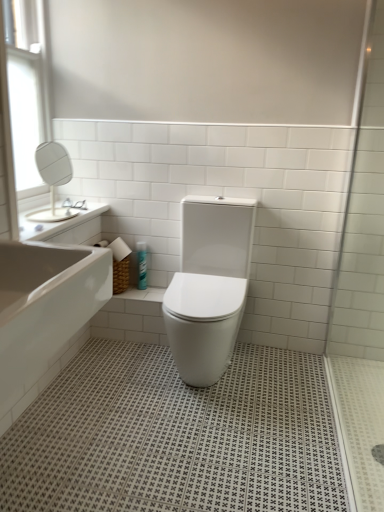
The width and height of the screenshot is (384, 512). I want to click on transparent glass shower door at right, so click(x=363, y=220).

What is the approximate height of white glossy toilet at center?

83.12 centimeters.

The width and height of the screenshot is (384, 512). Describe the element at coordinates (43, 313) in the screenshot. I see `white glossy bathtub at lower left` at that location.

Where is `white glass window at upper left`? white glass window at upper left is located at coordinates (26, 86).

Identify the location of white glossy sink at upper left. Image resolution: width=384 pixels, height=512 pixels. (60, 205).

From a real-world perspective, is woven brown basket at lower left physically located above or below blue glossy spray can at center?

In terms of real-world spatial position, woven brown basket at lower left is above blue glossy spray can at center.

I want to click on toiletry that appears below the woven brown basket at lower left (from the image's perspective), so click(x=142, y=265).

Is point (120, 240) farther from viewer compared to point (138, 268)?

That is True.

In the scene shown: Who is smaller, woven brown basket at lower left or blue glossy spray can at center?

blue glossy spray can at center.

Considering the points (59, 225) and (32, 364), which point is in front, point (59, 225) or point (32, 364)?

The point (32, 364) is closer to the camera.

Which object is further away from the camera, white glossy sink at upper left or white glossy bathtub at lower left?

white glossy sink at upper left is more distant.

From the image's perspective, is white glossy sink at upper left located above or below white glossy bathtub at lower left?

white glossy sink at upper left is above white glossy bathtub at lower left.

Considering the relative positions of white glossy bathtub at lower left and white glossy sink at upper left in the image provided, is white glossy bathtub at lower left to the right of white glossy sink at upper left from the viewer's perspective?

Yes, white glossy bathtub at lower left is to the right of white glossy sink at upper left.

Which is nearer, (56, 269) or (100, 226)?

The point (56, 269) is closer to the camera.

Is white glossy bathtub at lower left positioned far away from white glossy sink at upper left?

white glossy bathtub at lower left is actually quite close to white glossy sink at upper left.

Is white glossy bathtub at lower left wider or thinner than white glossy sink at upper left?

In the image, white glossy bathtub at lower left appears to be wider than white glossy sink at upper left.

Does point (9, 345) come in front of point (13, 5)?

Yes, point (9, 345) is in front of point (13, 5).

From the image's perspective, is white glossy bathtub at lower left located beneath white glass window at upper left?

Yes.

How different are the orientations of white glossy bathtub at lower left and white glass window at upper left in degrees?

The facing directions of white glossy bathtub at lower left and white glass window at upper left are 1.12 degrees apart.

Are white glossy bathtub at lower left and white glass window at upper left making contact?

They are not placed beside each other.

Considering the relative sizes of blue glossy spray can at center and white glossy bathtub at lower left in the image provided, is blue glossy spray can at center wider than white glossy bathtub at lower left?

In fact, blue glossy spray can at center might be narrower than white glossy bathtub at lower left.

Is blue glossy spray can at center oriented away from white glossy bathtub at lower left?

No, white glossy bathtub at lower left is not at the back of blue glossy spray can at center.

There is a blue glossy spray can at center. Identify the location of bath above it (from a real-world perspective). (43, 313).

What's the angular difference between blue glossy spray can at center and white glossy bathtub at lower left's facing directions?

The angular difference between blue glossy spray can at center and white glossy bathtub at lower left is 87.7 degrees.

Considering the positions of point (355, 272) and point (188, 369), is point (355, 272) closer or farther from the camera than point (188, 369)?

Point (355, 272).

Are transparent glass shower door at right and white glossy toilet at center making contact?

No.

Is transparent glass shower door at right facing away from white glossy toilet at center?

No.

From the image's perspective, does transparent glass shower door at right appear higher than white glossy toilet at center?

Yes, from the image's perspective, transparent glass shower door at right is above white glossy toilet at center.

Considering the relative positions of woven brown basket at lower left and transparent glass shower door at right in the image provided, is woven brown basket at lower left to the left or to the right of transparent glass shower door at right?

woven brown basket at lower left is positioned on transparent glass shower door at right's left side.

Does woven brown basket at lower left lie behind transparent glass shower door at right?

Answer: Yes, it is behind transparent glass shower door at right.

Is transparent glass shower door at right inside woven brown basket at lower left?

No, transparent glass shower door at right is located outside of woven brown basket at lower left.

This screenshot has height=512, width=384. In order to click on basket to the left of blue glossy spray can at center in this screenshot , I will do `click(118, 263)`.

Locate an element on the screen. sink behind the white glossy bathtub at lower left is located at coordinates (60, 205).

From the image, which object appears to be nearer to blue glossy spray can at center, woven brown basket at lower left or white glossy toilet at center?

Based on the image, woven brown basket at lower left appears to be nearer to blue glossy spray can at center.

Estimate the real-world distances between objects in this image. Which object is closer to transparent glass shower door at right, woven brown basket at lower left or white glossy bathtub at lower left?

woven brown basket at lower left.

Based on their spatial positions, is white glass window at upper left or white glossy sink at upper left closer to white glossy toilet at center?

white glossy sink at upper left is positioned closer to the anchor white glossy toilet at center.

From the image, which object appears to be nearer to woven brown basket at lower left, white glossy toilet at center or transparent glass shower door at right?

white glossy toilet at center.

Looking at the image, which one is located closer to transparent glass shower door at right, woven brown basket at lower left or white glossy toilet at center?

white glossy toilet at center lies closer to transparent glass shower door at right than the other object.

Based on the photo, looking at the image, which one is located further to white glossy bathtub at lower left, white glossy sink at upper left or transparent glass shower door at right?

transparent glass shower door at right lies further to white glossy bathtub at lower left than the other object.

Which object lies nearer to the anchor point white glossy toilet at center, white glass window at upper left or blue glossy spray can at center?

blue glossy spray can at center lies closer to white glossy toilet at center than the other object.

From the image, which object appears to be nearer to white glossy sink at upper left, transparent glass shower door at right or blue glossy spray can at center?

Based on the image, blue glossy spray can at center appears to be nearer to white glossy sink at upper left.

Locate an element on the screen. basket between white glass window at upper left and white glossy toilet at center in the vertical direction is located at coordinates (118, 263).

Locate an element on the screen. window located between white glossy bathtub at lower left and woven brown basket at lower left in the depth direction is located at coordinates (26, 86).

Find the location of a particular element. basket between white glass window at upper left and blue glossy spray can at center vertically is located at coordinates (118, 263).

At what (x,y) coordinates should I click in order to perform the action: click on toilet between white glossy bathtub at lower left and woven brown basket at lower left along the z-axis. Please return your answer as a coordinate pair (x, y). Looking at the image, I should click on (209, 286).